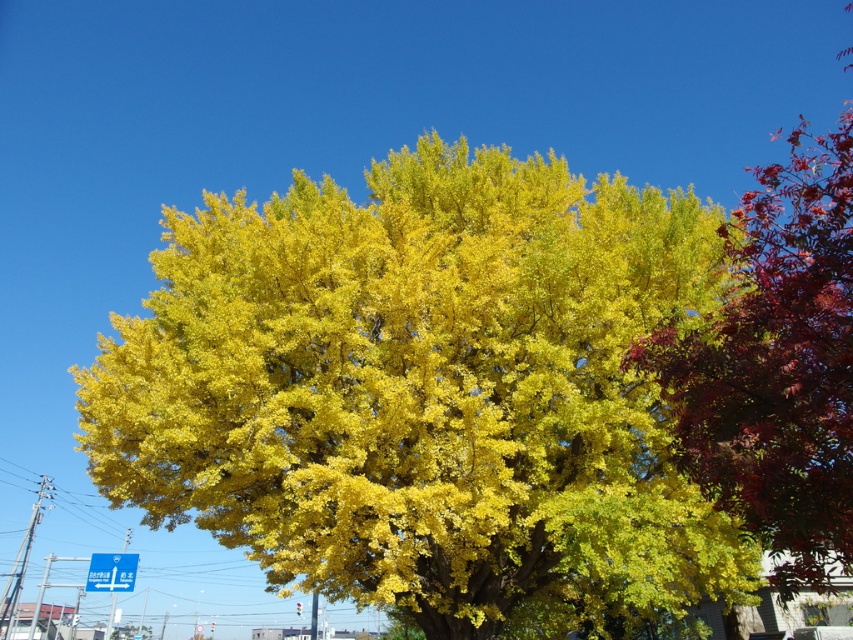
You are a bird flying over the scene and want to land on the tallest leaves. Which leaves should you choose between the golden yellow leaves at center and the shiny red leaves at upper right?

The shiny red leaves at upper right are taller than the golden yellow leaves at center, so you should choose the shiny red leaves at upper right to land on.

You are standing in front of the two trees and want to place a small bench between them. The bench is 1 meter long. You notice two points marked on the ground at coordinates point (425, 332) and point (773, 204). Which point is closer to you, and can the bench fit between them?

Point (425, 332) is closer to you than point (773, 204). The distance between the two points is not provided, so it is unclear if the bench will fit between them.